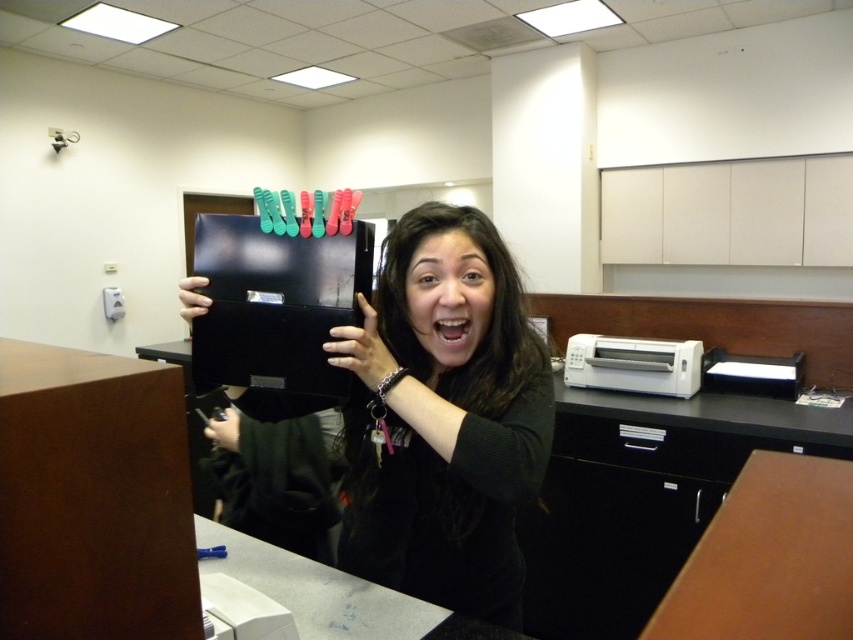
Question: Estimate the real-world distances between objects in this image. Which object is farther from the black matte file cabinet at lower right?

Choices:
 (A) brown wood table at lower right
 (B) matte black folder at center

Answer: (B)

Question: Can you confirm if matte black folder at center is positioned below black matte file cabinet at lower right?

Choices:
 (A) yes
 (B) no

Answer: (B)

Question: Where is black matte file cabinet at lower right located in relation to brown wood table at lower right in the image?

Choices:
 (A) below
 (B) above

Answer: (A)

Question: Which point is farther from the camera taking this photo?

Choices:
 (A) (398, 406)
 (B) (656, 595)

Answer: (B)

Question: Is matte black folder at center above black matte file cabinet at lower right?

Choices:
 (A) no
 (B) yes

Answer: (B)

Question: Which point is closer to the camera taking this photo?

Choices:
 (A) (756, 604)
 (B) (604, 433)
 (C) (428, 577)

Answer: (A)